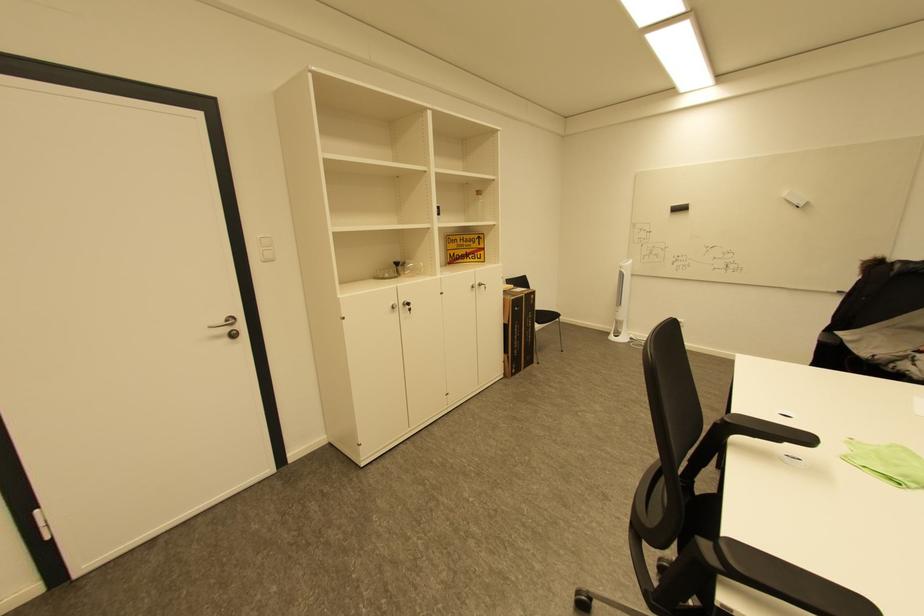
The height and width of the screenshot is (616, 924). Find the location of `white board eraser`. white board eraser is located at coordinates (796, 199).